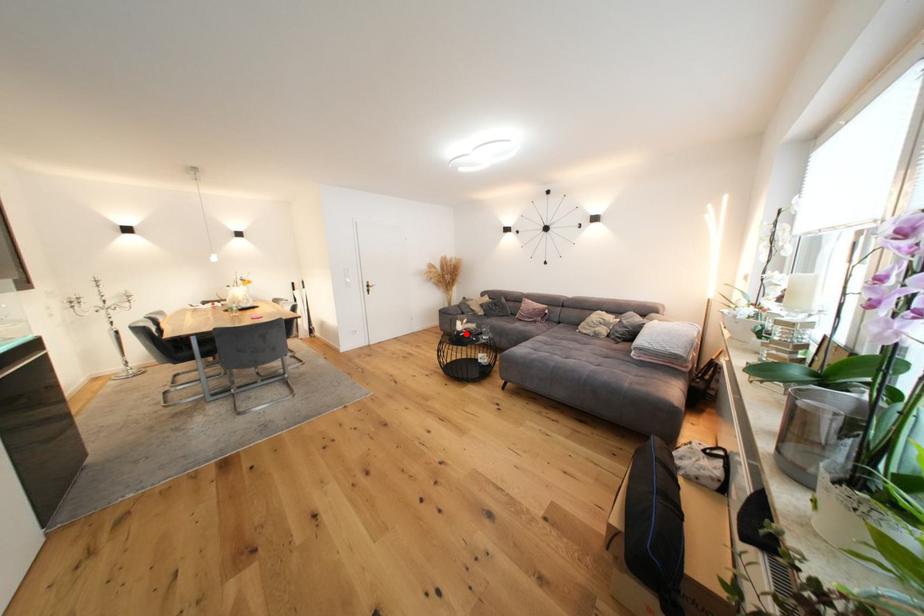
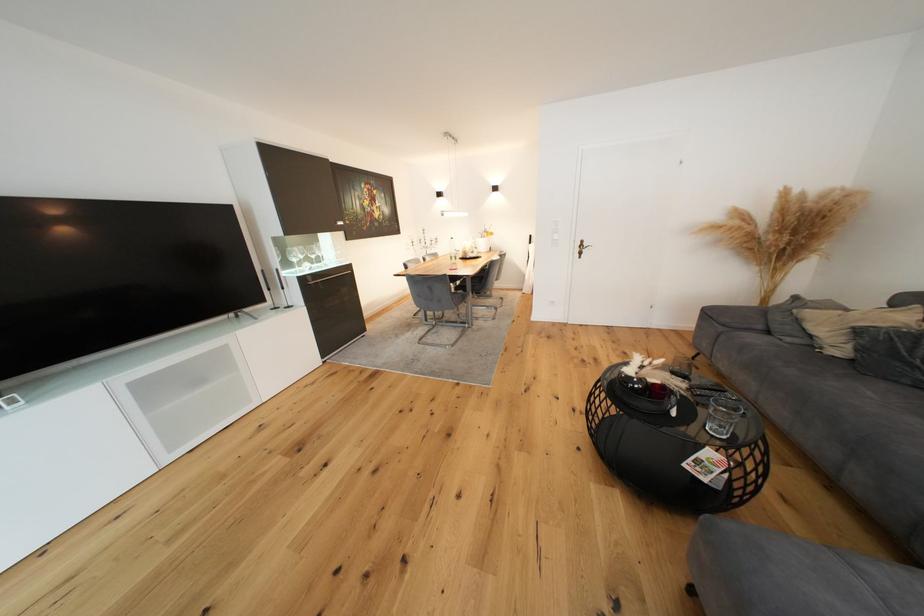
Locate, in the second image, the point that corresponds to the highlighted location in the first image.

(637, 379)